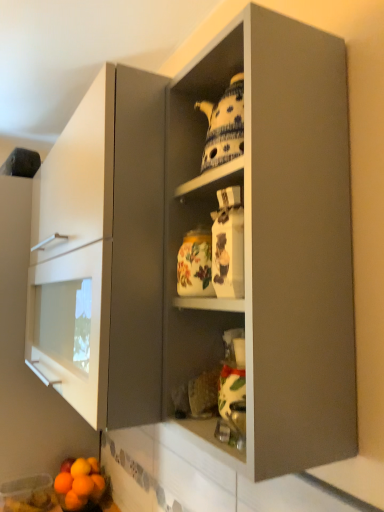
Question: Is orange matte at lower left, which is the second orange in right-to-left order, wider than matte gray cabinet at center?

Choices:
 (A) yes
 (B) no

Answer: (B)

Question: Can you confirm if orange matte at lower left, which is the second orange in right-to-left order, is taller than matte gray cabinet at center?

Choices:
 (A) yes
 (B) no

Answer: (B)

Question: Does orange matte at lower left, which is the 4th orange in left-to-right order, come in front of matte gray cabinet at center?

Choices:
 (A) no
 (B) yes

Answer: (A)

Question: From the image's perspective, is orange matte at lower left, which is the 4th orange in left-to-right order, located above matte gray cabinet at center?

Choices:
 (A) no
 (B) yes

Answer: (A)

Question: Is orange matte at lower left, which is the second orange in right-to-left order, far away from matte gray cabinet at center?

Choices:
 (A) no
 (B) yes

Answer: (B)

Question: Does orange matte at lower left, which is the 4th orange in left-to-right order, have a lesser height compared to matte gray cabinet at center?

Choices:
 (A) no
 (B) yes

Answer: (B)

Question: Is smooth orange grapefruit at lower left taller than porcelain teapot at upper center?

Choices:
 (A) yes
 (B) no

Answer: (B)

Question: Is smooth orange grapefruit at lower left wider than porcelain teapot at upper center?

Choices:
 (A) no
 (B) yes

Answer: (B)

Question: Is smooth orange grapefruit at lower left behind porcelain teapot at upper center?

Choices:
 (A) no
 (B) yes

Answer: (B)

Question: Is smooth orange grapefruit at lower left facing towards porcelain teapot at upper center?

Choices:
 (A) no
 (B) yes

Answer: (A)

Question: From a real-world perspective, is smooth orange grapefruit at lower left on porcelain teapot at upper center?

Choices:
 (A) yes
 (B) no

Answer: (B)

Question: Is smooth orange grapefruit at lower left in contact with porcelain teapot at upper center?

Choices:
 (A) no
 (B) yes

Answer: (A)

Question: Can you confirm if matte gray cabinet at center is thinner than orange matte at lower left, which is the 4th orange in left-to-right order?

Choices:
 (A) yes
 (B) no

Answer: (B)